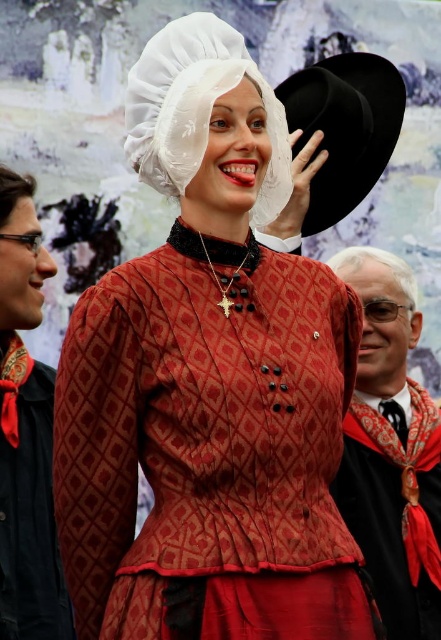
Based on the scene description, which object is located higher in the image between the matte red dress at center and the white sheer bonnet at center?

The white sheer bonnet at center is higher because it is stated that the matte red dress at center is positioned under it.

From the picture: You are a photographer at a historical event. You want to take a photo of the matte red dress at center and the smooth black hat at right. If you need to ensure both objects are in focus, which object should you focus on first?

The matte red dress at center is larger in size than the smooth black hat at right, so you should focus on the matte red dress at center first to ensure both are in focus.